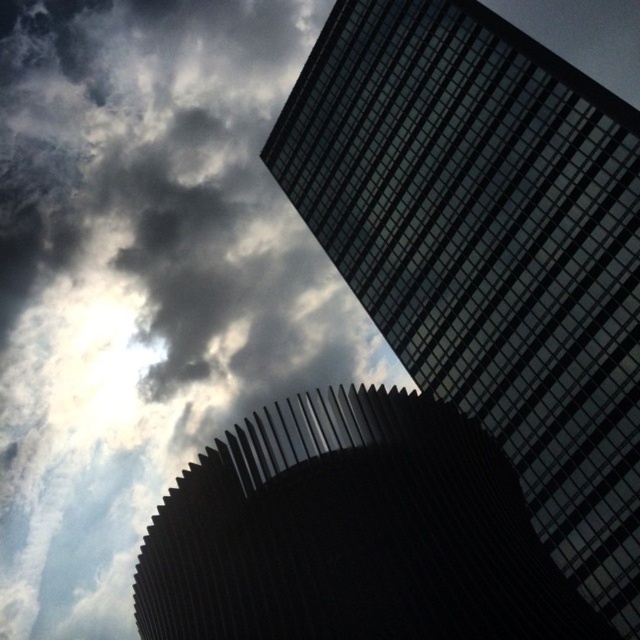
Question: Is glassy reflective skyscraper at upper right thinner than rough metal structure at lower center?

Choices:
 (A) yes
 (B) no

Answer: (A)

Question: Which of the following is the closest to the observer?

Choices:
 (A) glassy reflective skyscraper at upper right
 (B) rough metal structure at lower center

Answer: (B)

Question: Estimate the real-world distances between objects in this image. Which object is closer to the rough metal structure at lower center?

Choices:
 (A) cloudy sky at upper left
 (B) glassy reflective skyscraper at upper right

Answer: (B)

Question: Is glassy reflective skyscraper at upper right to the left of rough metal structure at lower center from the viewer's perspective?

Choices:
 (A) no
 (B) yes

Answer: (A)

Question: Is glassy reflective skyscraper at upper right wider than rough metal structure at lower center?

Choices:
 (A) no
 (B) yes

Answer: (A)

Question: Which point appears farthest from the camera in this image?

Choices:
 (A) (218, 204)
 (B) (608, 204)
 (C) (420, 396)

Answer: (A)